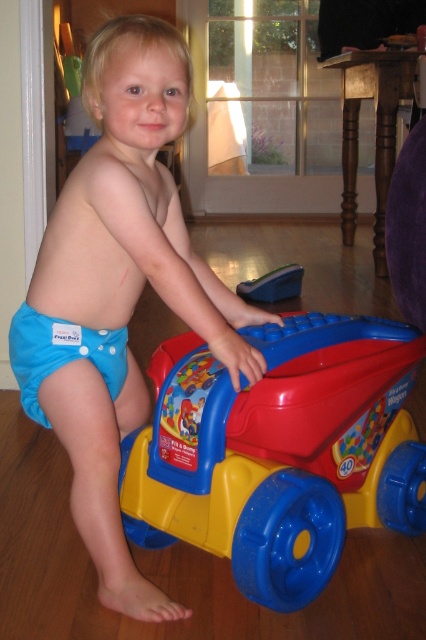
Question: Based on their relative distances, which object is farther from the matte plastic toy car at lower center?

Choices:
 (A) blue plastic toy car at center
 (B) blue fabric diaper at lower left

Answer: (A)

Question: Which object appears farthest from the camera in this image?

Choices:
 (A) blue plastic toy car at center
 (B) blue fabric diaper at center
 (C) matte plastic toy car at lower center
 (D) blue fabric diaper at lower left

Answer: (A)

Question: Is blue fabric diaper at lower left above blue plastic toy car at center?

Choices:
 (A) yes
 (B) no

Answer: (B)

Question: Among these points, which one is nearest to the camera?

Choices:
 (A) pyautogui.click(x=276, y=278)
 (B) pyautogui.click(x=25, y=344)

Answer: (B)

Question: Does blue fabric diaper at center come in front of matte plastic toy car at lower center?

Choices:
 (A) yes
 (B) no

Answer: (B)

Question: Does blue fabric diaper at center appear over blue plastic toy car at center?

Choices:
 (A) no
 (B) yes

Answer: (A)